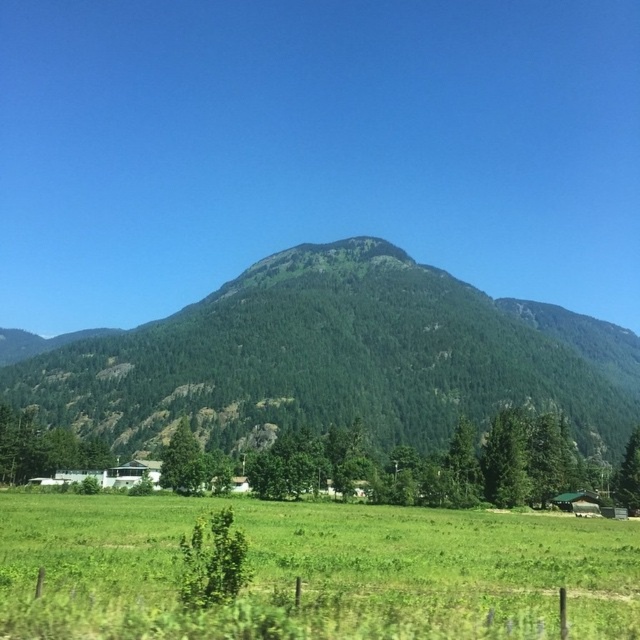
Question: Does green textured mountain at center appear under green grass at lower center?

Choices:
 (A) yes
 (B) no

Answer: (B)

Question: Is green leafy tree at lower left smaller than green leafy tree at center?

Choices:
 (A) yes
 (B) no

Answer: (B)

Question: Does green textured mountain at center lie behind green matte tree at lower right?

Choices:
 (A) no
 (B) yes

Answer: (B)

Question: Which point is farther to the camera?

Choices:
 (A) green leafy tree at lower left
 (B) green textured mountain at center
 (C) green matte tree at lower right

Answer: (B)

Question: Which object is closer to the camera taking this photo?

Choices:
 (A) green leafy tree at lower left
 (B) green matte tree at lower right

Answer: (B)

Question: Which of the following is the farthest from the observer?

Choices:
 (A) (307, 595)
 (B) (456, 468)

Answer: (B)